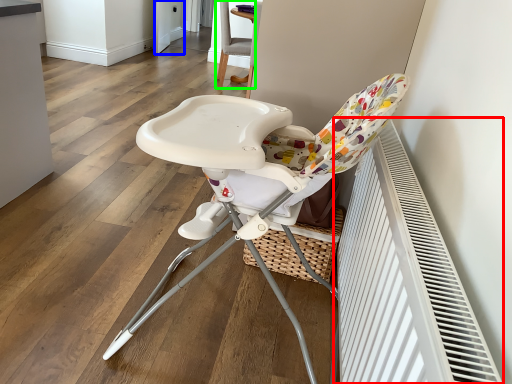
Question: Which object is positioned farthest from air conditioning (highlighted by a red box)? Select from screen door (highlighted by a blue box) and chair (highlighted by a green box).

Choices:
 (A) screen door
 (B) chair

Answer: (A)